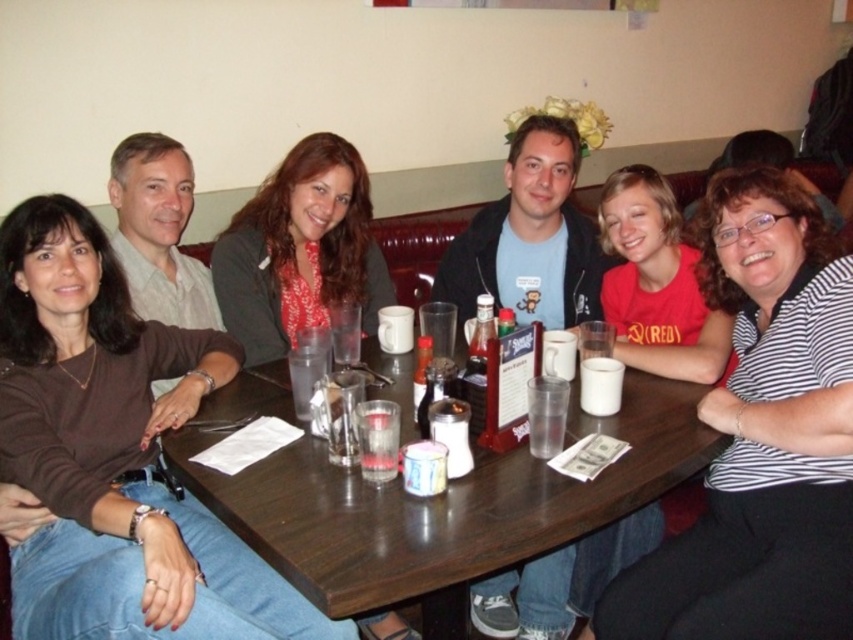
Question: Does wooden table at center appear under clear plastic cup at table center?

Choices:
 (A) no
 (B) yes

Answer: (B)

Question: Among these points, which one is farthest from the camera?

Choices:
 (A) (345, 579)
 (B) (595, 406)
 (C) (335, 172)

Answer: (C)

Question: Which object is the farthest from the matte gray cardigan at center?

Choices:
 (A) wooden table at center
 (B) striped shirt at right

Answer: (B)

Question: Estimate the real-world distances between objects in this image. Which object is farther from the matte gray cardigan at center?

Choices:
 (A) transparent glass at table center
 (B) striped shirt at right
 (C) wooden table at center

Answer: (B)

Question: Does striped shirt at right have a larger size compared to matte gray cardigan at center?

Choices:
 (A) no
 (B) yes

Answer: (B)

Question: Can you confirm if clear plastic cup at table center is positioned above clear glass at table center?

Choices:
 (A) yes
 (B) no

Answer: (A)